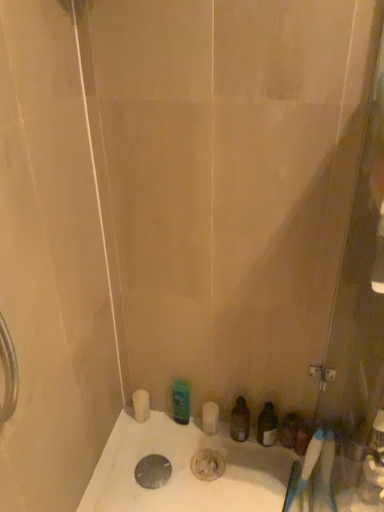
Question: Considering the relative positions of white plastic toothbrush at lower right and green matte bottle at center, marked as the third toiletry in a right-to-left arrangement, in the image provided, is white plastic toothbrush at lower right in front of green matte bottle at center, marked as the third toiletry in a right-to-left arrangement,?

Choices:
 (A) yes
 (B) no

Answer: (A)

Question: Does white plastic toothbrush at lower right have a greater height compared to green matte bottle at center, the 1th toiletry in the left-to-right sequence?

Choices:
 (A) yes
 (B) no

Answer: (A)

Question: Is white plastic toothbrush at lower right next to green matte bottle at center, marked as the third toiletry in a right-to-left arrangement?

Choices:
 (A) no
 (B) yes

Answer: (A)

Question: From a real-world perspective, is white plastic toothbrush at lower right located higher than green matte bottle at center, the 1th toiletry in the left-to-right sequence?

Choices:
 (A) yes
 (B) no

Answer: (A)

Question: Are white plastic toothbrush at lower right and green matte bottle at center, marked as the third toiletry in a right-to-left arrangement, located far from each other?

Choices:
 (A) yes
 (B) no

Answer: (B)

Question: In terms of size, does translucent plastic bottle at lower center, which appears as the 2th toiletry when viewed from the right, appear bigger or smaller than white plastic toothbrush at lower right?

Choices:
 (A) small
 (B) big

Answer: (A)

Question: Is point (230, 431) positioned closer to the camera than point (299, 479)?

Choices:
 (A) closer
 (B) farther

Answer: (B)

Question: Visually, is translucent plastic bottle at lower center, the second toiletry from the left, positioned to the left or to the right of white plastic toothbrush at lower right?

Choices:
 (A) right
 (B) left

Answer: (B)

Question: From the image's perspective, is translucent plastic bottle at lower center, the second toiletry from the left, located above or below white plastic toothbrush at lower right?

Choices:
 (A) below
 (B) above

Answer: (B)

Question: In terms of height, does white plastic toothbrush at lower right look taller or shorter compared to translucent plastic soap dispenser at lower right, positioned as the first toiletry in right-to-left order?

Choices:
 (A) short
 (B) tall

Answer: (B)

Question: Is white plastic toothbrush at lower right wider or thinner than translucent plastic soap dispenser at lower right, positioned as the first toiletry in right-to-left order?

Choices:
 (A) wide
 (B) thin

Answer: (A)

Question: From the image's perspective, is white plastic toothbrush at lower right above or below translucent plastic soap dispenser at lower right, the third toiletry in the left-to-right sequence?

Choices:
 (A) above
 (B) below

Answer: (B)

Question: Which is correct: white plastic toothbrush at lower right is inside translucent plastic soap dispenser at lower right, the third toiletry in the left-to-right sequence, or outside of it?

Choices:
 (A) inside
 (B) outside

Answer: (B)

Question: Does point (144, 466) appear closer or farther from the camera than point (177, 402)?

Choices:
 (A) farther
 (B) closer

Answer: (B)

Question: From a real-world perspective, is metallic silver drain at bottom center positioned above or below green matte bottle at center, marked as the third toiletry in a right-to-left arrangement?

Choices:
 (A) above
 (B) below

Answer: (B)